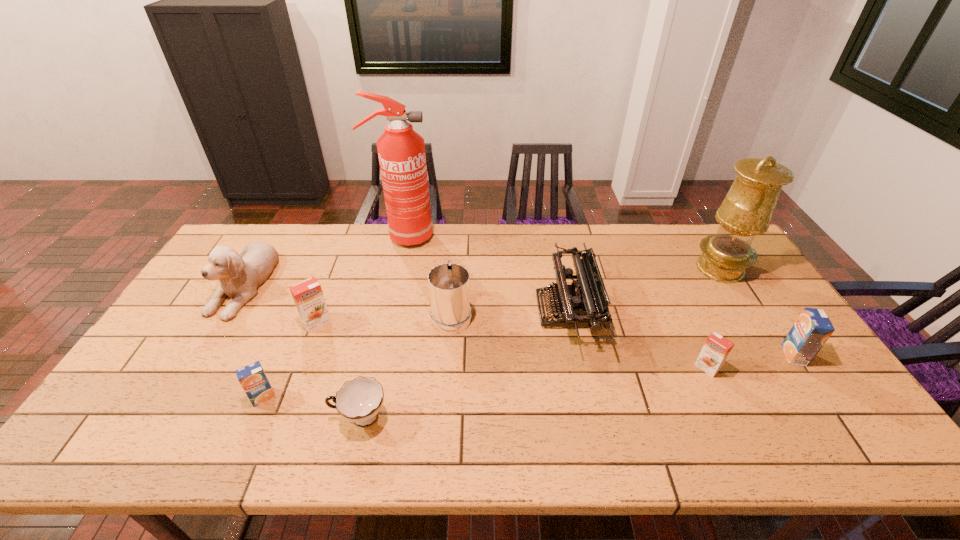
Image resolution: width=960 pixels, height=540 pixels. I want to click on orange_juice situated at the right edge, so click(812, 329).

The image size is (960, 540). Identify the location of object that is at the far left corner. pos(240,275).

Where is `object that is at the far right corner`? The height and width of the screenshot is (540, 960). object that is at the far right corner is located at coordinates (746, 211).

I want to click on vacant area at the far edge of the desktop, so click(626, 245).

This screenshot has width=960, height=540. What are the coordinates of `vacant space at the near edge` in the screenshot? It's located at (564, 436).

The image size is (960, 540). In order to click on vacant area between the nearer orange orange juice and the gray mug in this screenshot , I will do `click(579, 340)`.

The image size is (960, 540). Find the location of `empty space that is in between the left orange orange juice and the oil lamp`. empty space that is in between the left orange orange juice and the oil lamp is located at coordinates (518, 295).

Locate an element on the screen. This screenshot has height=540, width=960. empty location between the smaller orange orange juice and the bigger orange orange juice is located at coordinates (512, 345).

In order to click on blank region between the typewriter and the nearest orange_juice in this screenshot , I will do `click(415, 354)`.

The height and width of the screenshot is (540, 960). Identify the location of free space between the nearest orange_juice and the tallest object. (333, 317).